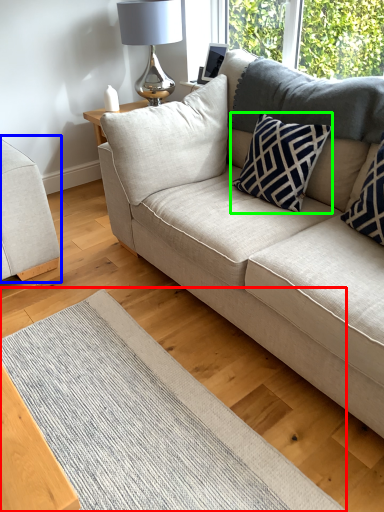
Question: Considering the real-world distances, which object is closest to mat (highlighted by a red box)? studio couch (highlighted by a blue box) or pillow (highlighted by a green box).

Choices:
 (A) studio couch
 (B) pillow

Answer: (A)